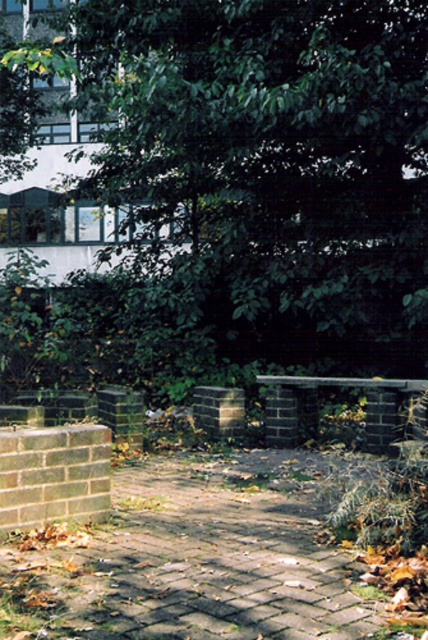
Looking at this image, between green leafy tree at upper center and brick paved path at center, which one appears on the right side from the viewer's perspective?

brick paved path at center is more to the right.

Identify the location of green leafy tree at upper center. The width and height of the screenshot is (428, 640). (267, 176).

Identify the location of green leafy tree at upper center. (267, 176).